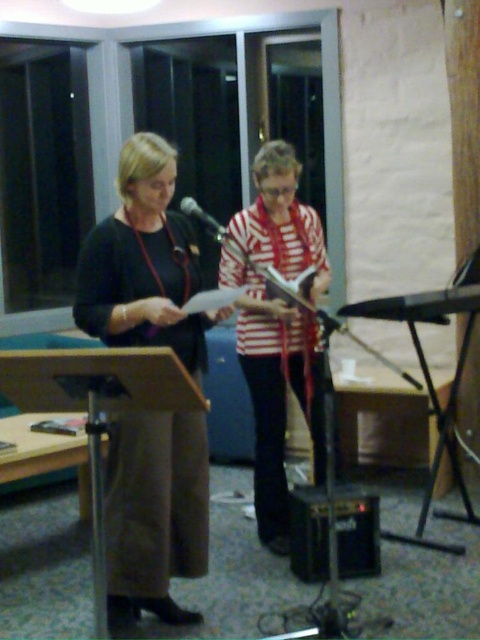
Question: Which of the following is the closest to the observer?

Choices:
 (A) striped fabric at center
 (B) matte black dress at center

Answer: (B)

Question: Is striped fabric at center closer to camera compared to black matte microphone at center?

Choices:
 (A) no
 (B) yes

Answer: (A)

Question: Can you confirm if striped fabric at center is wider than black matte microphone at center?

Choices:
 (A) no
 (B) yes

Answer: (B)

Question: Is matte black dress at center in front of black matte microphone at center?

Choices:
 (A) yes
 (B) no

Answer: (A)

Question: Which of the following is the farthest from the observer?

Choices:
 (A) black matte microphone at center
 (B) matte black dress at center

Answer: (A)

Question: Among these objects, which one is nearest to the camera?

Choices:
 (A) matte black dress at center
 (B) striped fabric at center

Answer: (A)